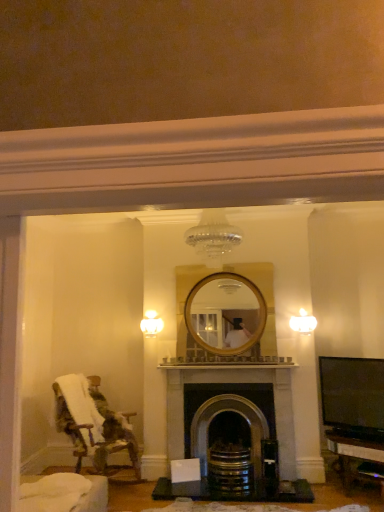
The width and height of the screenshot is (384, 512). What do you see at coordinates (232, 382) in the screenshot?
I see `dark gray stone fireplace at center` at bounding box center [232, 382].

Image resolution: width=384 pixels, height=512 pixels. I want to click on white glass light fixture at upper center, marked as the second light fixture in a right-to-left arrangement, so click(151, 324).

How much space does white glass light fixture at upper center, marked as the 1th light fixture in a left-to-right arrangement, occupy horizontally?

It is 4.46 inches.

Describe the element at coordinates (303, 322) in the screenshot. I see `white frosted glass sconce at upper right, placed as the second light fixture when sorted from left to right` at that location.

You are a GUI agent. You are given a task and a screenshot of the screen. Output one action in this format:
    pyautogui.click(x=<x>, y=<y>)
    Task: Click on the dark gray stone fireplace at center
    This screenshot has height=512, width=384.
    Given the screenshot: What is the action you would take?
    pyautogui.click(x=232, y=382)

Who is bigger, dark gray stone fireplace at center or white frosted glass sconce at upper right, the first light fixture positioned from the front?

With larger size is dark gray stone fireplace at center.

How different are the orientations of dark gray stone fireplace at center and white frosted glass sconce at upper right, placed as the second light fixture when sorted from left to right, in degrees?

There is a 0.622-degree angle between the facing directions of dark gray stone fireplace at center and white frosted glass sconce at upper right, placed as the second light fixture when sorted from left to right.

Between dark gray stone fireplace at center and white frosted glass sconce at upper right, which is counted as the first light fixture, starting from the right, which one has smaller width?

white frosted glass sconce at upper right, which is counted as the first light fixture, starting from the right.

From the image's perspective, is dark gray stone fireplace at center positioned above or below white frosted glass sconce at upper right, the first light fixture positioned from the front?

dark gray stone fireplace at center is below white frosted glass sconce at upper right, the first light fixture positioned from the front.

Looking at this image, from a real-world perspective, is white frosted glass sconce at upper right, the first light fixture positioned from the front, physically above dark gray stone fireplace at center?

Yes, from a real-world perspective, white frosted glass sconce at upper right, the first light fixture positioned from the front, is above dark gray stone fireplace at center.

Is white frosted glass sconce at upper right, which is counted as the first light fixture, starting from the right, positioned before dark gray stone fireplace at center?

No, the depth of white frosted glass sconce at upper right, which is counted as the first light fixture, starting from the right, is greater than that of dark gray stone fireplace at center.

Can you confirm if white frosted glass sconce at upper right, placed as the second light fixture when sorted from left to right, is taller than dark gray stone fireplace at center?

No, white frosted glass sconce at upper right, placed as the second light fixture when sorted from left to right, is not taller than dark gray stone fireplace at center.

Does point (307, 323) come farther from viewer compared to point (162, 436)?

That is True.

How distant is white frosted glass sconce at upper right, which is counted as the second light fixture, starting from the back, from fluffy fabric chair at left?

They are 2.32 meters apart.

Considering the relative sizes of white frosted glass sconce at upper right, placed as the second light fixture when sorted from left to right, and fluffy fabric chair at left in the image provided, is white frosted glass sconce at upper right, placed as the second light fixture when sorted from left to right, bigger than fluffy fabric chair at left?

Incorrect, white frosted glass sconce at upper right, placed as the second light fixture when sorted from left to right, is not larger than fluffy fabric chair at left.

From the image's perspective, is white frosted glass sconce at upper right, which is counted as the second light fixture, starting from the back, above or below fluffy fabric chair at left?

Based on their image positions, white frosted glass sconce at upper right, which is counted as the second light fixture, starting from the back, is located above fluffy fabric chair at left.

Is fluffy fabric chair at left at the right side of dark gray stone fireplace at center?

No.

Based on the photo, from a real-world perspective, relative to dark gray stone fireplace at center, is fluffy fabric chair at left vertically above or below?

In terms of real-world spatial position, fluffy fabric chair at left is below dark gray stone fireplace at center.

Can you tell me how much fluffy fabric chair at left and dark gray stone fireplace at center differ in facing direction?

59.8 degrees separate the facing orientations of fluffy fabric chair at left and dark gray stone fireplace at center.

Based on the photo, would you say fluffy fabric chair at left contains dark gray stone fireplace at center?

No, fluffy fabric chair at left does not contain dark gray stone fireplace at center.

From their relative heights in the image, would you say white glass light fixture at upper center, the second light fixture when ordered from front to back, is taller or shorter than white frosted glass sconce at upper right, placed as the second light fixture when sorted from left to right?

Clearly, white glass light fixture at upper center, the second light fixture when ordered from front to back, is shorter compared to white frosted glass sconce at upper right, placed as the second light fixture when sorted from left to right.

How distant is white glass light fixture at upper center, marked as the second light fixture in a right-to-left arrangement, from white frosted glass sconce at upper right, the first light fixture positioned from the front?

The distance of white glass light fixture at upper center, marked as the second light fixture in a right-to-left arrangement, from white frosted glass sconce at upper right, the first light fixture positioned from the front, is 5.01 feet.

Is point (159, 321) positioned before point (303, 313)?

No, it is behind (303, 313).

Considering their positions, is white glass light fixture at upper center, the first light fixture in the back-to-front sequence, located in front of or behind white frosted glass sconce at upper right, the first light fixture positioned from the front?

Visually, white glass light fixture at upper center, the first light fixture in the back-to-front sequence, is located behind white frosted glass sconce at upper right, the first light fixture positioned from the front.

Could white glass light fixture at upper center, the second light fixture when ordered from front to back, be considered to be inside white frosted glass sconce at upper right, the first light fixture positioned from the front?

Definitely not — white glass light fixture at upper center, the second light fixture when ordered from front to back, is not inside white frosted glass sconce at upper right, the first light fixture positioned from the front.

Could you tell me if white frosted glass sconce at upper right, which is counted as the first light fixture, starting from the right, is turned towards white glass light fixture at upper center, the second light fixture when ordered from front to back?

No, white frosted glass sconce at upper right, which is counted as the first light fixture, starting from the right, is not aimed at white glass light fixture at upper center, the second light fixture when ordered from front to back.

Is white frosted glass sconce at upper right, which is counted as the second light fixture, starting from the back, to the left or to the right of white glass light fixture at upper center, the second light fixture when ordered from front to back, in the image?

Based on their positions, white frosted glass sconce at upper right, which is counted as the second light fixture, starting from the back, is located to the right of white glass light fixture at upper center, the second light fixture when ordered from front to back.

Is the surface of white frosted glass sconce at upper right, which is counted as the second light fixture, starting from the back, in direct contact with white glass light fixture at upper center, the first light fixture in the back-to-front sequence?

white frosted glass sconce at upper right, which is counted as the second light fixture, starting from the back, and white glass light fixture at upper center, the first light fixture in the back-to-front sequence, are not in contact.

Which object is more forward, fluffy fabric chair at left or white frosted glass sconce at upper right, which is counted as the second light fixture, starting from the back?

fluffy fabric chair at left is more forward.

Is point (98, 418) farther from camera compared to point (309, 333)?

No.

From the image's perspective, between fluffy fabric chair at left and white frosted glass sconce at upper right, which is counted as the second light fixture, starting from the back, who is located below?

fluffy fabric chair at left is shown below in the image.

How many degrees apart are the facing directions of fluffy fabric chair at left and white frosted glass sconce at upper right, the first light fixture positioned from the front?

fluffy fabric chair at left and white frosted glass sconce at upper right, the first light fixture positioned from the front, are facing 60.4 degrees away from each other.

In order to click on fireplace on the left of white frosted glass sconce at upper right, placed as the second light fixture when sorted from left to right in this screenshot , I will do `click(232, 382)`.

Identify the location of the 2nd light fixture above the dark gray stone fireplace at center (from the image's perspective). (303, 322).

From the image, which object appears to be nearer to white glass light fixture at upper center, marked as the 1th light fixture in a left-to-right arrangement, dark gray stone fireplace at center or white frosted glass sconce at upper right, placed as the second light fixture when sorted from left to right?

The object closer to white glass light fixture at upper center, marked as the 1th light fixture in a left-to-right arrangement, is dark gray stone fireplace at center.

From the image, which object appears to be farther from dark gray stone fireplace at center, fluffy fabric chair at left or white frosted glass sconce at upper right, which is counted as the second light fixture, starting from the back?

Based on the image, white frosted glass sconce at upper right, which is counted as the second light fixture, starting from the back, appears to be further to dark gray stone fireplace at center.

Looking at the image, which one is located further to dark gray stone fireplace at center, white glass light fixture at upper center, marked as the 1th light fixture in a left-to-right arrangement, or white frosted glass sconce at upper right, placed as the second light fixture when sorted from left to right?

The object further to dark gray stone fireplace at center is white glass light fixture at upper center, marked as the 1th light fixture in a left-to-right arrangement.

Looking at this image, based on their spatial positions, is fluffy fabric chair at left or white frosted glass sconce at upper right, the first light fixture positioned from the front, further from white glass light fixture at upper center, the first light fixture in the back-to-front sequence?

white frosted glass sconce at upper right, the first light fixture positioned from the front, is positioned further to the anchor white glass light fixture at upper center, the first light fixture in the back-to-front sequence.

Estimate the real-world distances between objects in this image. Which object is closer to fluffy fabric chair at left, dark gray stone fireplace at center or white frosted glass sconce at upper right, placed as the second light fixture when sorted from left to right?

The object closer to fluffy fabric chair at left is dark gray stone fireplace at center.

Estimate the real-world distances between objects in this image. Which object is closer to dark gray stone fireplace at center, white frosted glass sconce at upper right, placed as the second light fixture when sorted from left to right, or fluffy fabric chair at left?

fluffy fabric chair at left is closer to dark gray stone fireplace at center.

From the image, which object appears to be nearer to white frosted glass sconce at upper right, which is counted as the second light fixture, starting from the back, fluffy fabric chair at left or dark gray stone fireplace at center?

dark gray stone fireplace at center lies closer to white frosted glass sconce at upper right, which is counted as the second light fixture, starting from the back, than the other object.

Looking at the image, which one is located further to dark gray stone fireplace at center, fluffy fabric chair at left or white glass light fixture at upper center, the second light fixture when ordered from front to back?

white glass light fixture at upper center, the second light fixture when ordered from front to back.

Where is `light fixture between fluffy fabric chair at left and dark gray stone fireplace at center`? light fixture between fluffy fabric chair at left and dark gray stone fireplace at center is located at coordinates (151, 324).

The image size is (384, 512). I want to click on fireplace between white glass light fixture at upper center, marked as the 1th light fixture in a left-to-right arrangement, and white frosted glass sconce at upper right, which is counted as the first light fixture, starting from the right, from left to right, so click(x=232, y=382).

At what (x,y) coordinates should I click in order to perform the action: click on light fixture located between fluffy fabric chair at left and white frosted glass sconce at upper right, the first light fixture positioned from the front, in the left-right direction. Please return your answer as a coordinate pair (x, y). Looking at the image, I should click on (151, 324).

Locate an element on the screen. The image size is (384, 512). fireplace between fluffy fabric chair at left and white frosted glass sconce at upper right, placed as the second light fixture when sorted from left to right is located at coordinates (232, 382).